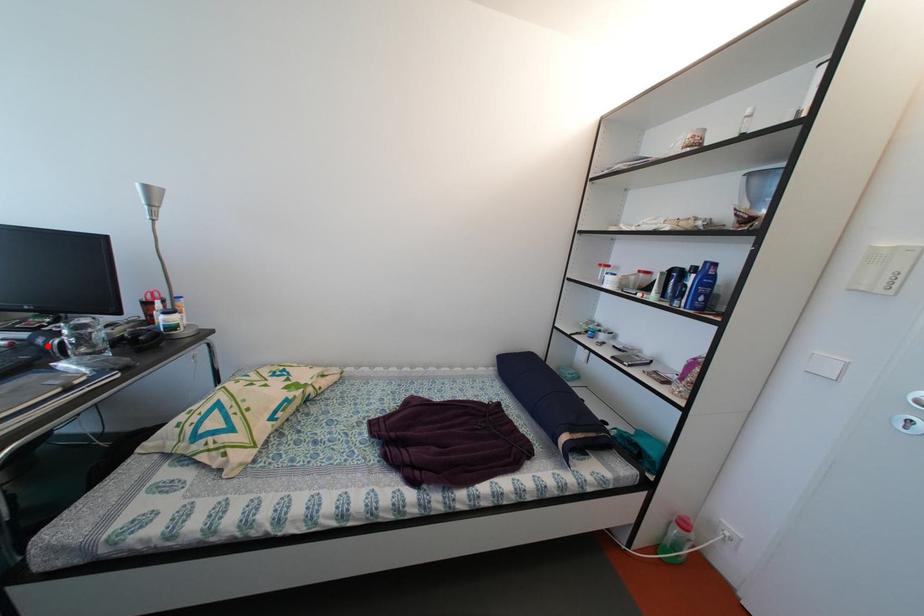
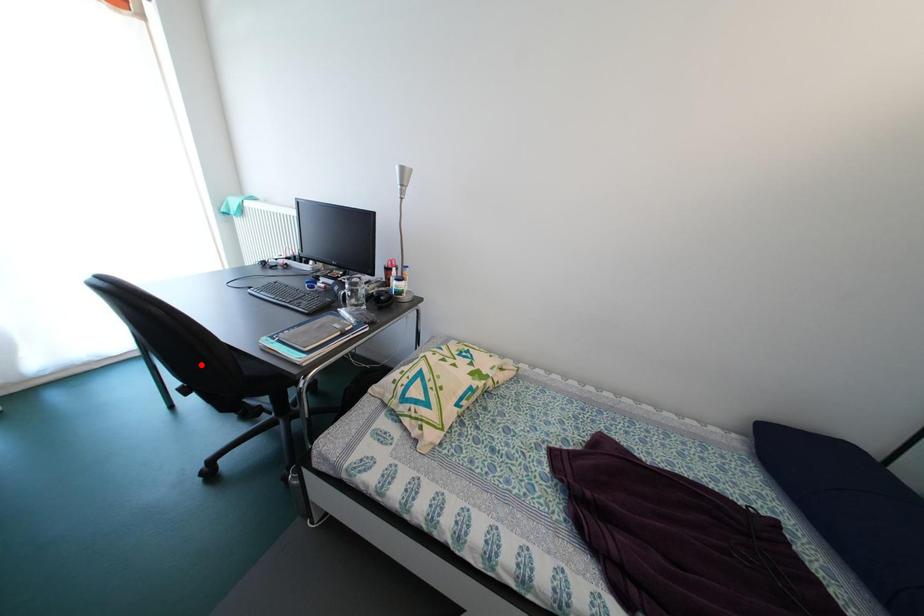
I am providing you with two images of the same scene from different viewpoints. A red point is marked on the first image and another point is marked on the second image. Does the point marked in image1 correspond to the same location as the one in image2?

No